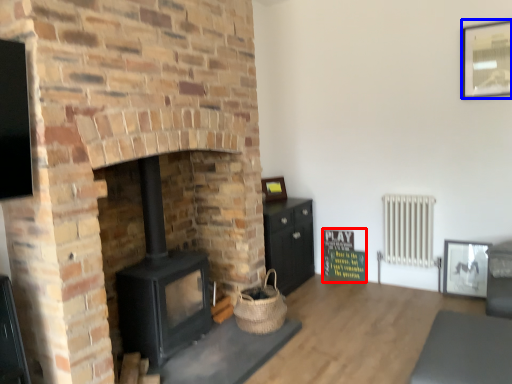
Question: Which object is further to the camera taking this photo, bulletin board (highlighted by a red box) or picture frame (highlighted by a blue box)?

Choices:
 (A) bulletin board
 (B) picture frame

Answer: (A)